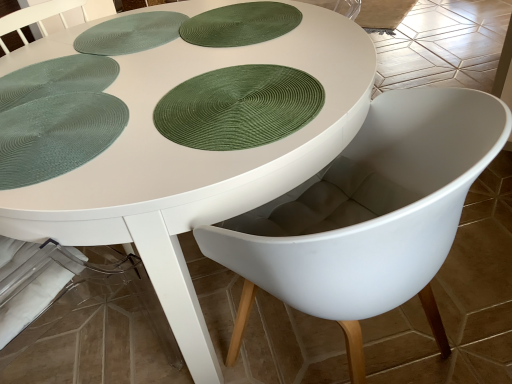
Locate an element on the screen. This screenshot has width=512, height=384. free area behind green woven placemat at center, which is counted as the third paper plate, starting from the top is located at coordinates (225, 49).